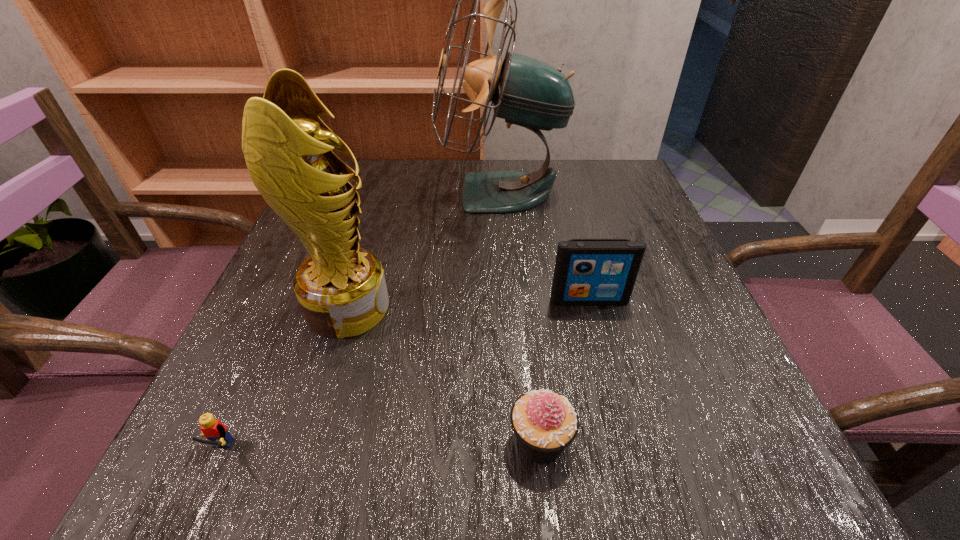
Identify the location of vacant area at the near edge of the desktop. This screenshot has width=960, height=540. (353, 470).

You are a GUI agent. You are given a task and a screenshot of the screen. Output one action in this format:
    pyautogui.click(x=<x>, y=<y>)
    Task: Click on the free space at the left edge of the desktop
    The image size is (960, 540).
    Given the screenshot: What is the action you would take?
    pyautogui.click(x=295, y=395)

Locate an element on the screen. free location at the right edge of the desktop is located at coordinates (681, 282).

I want to click on free space at the far left corner of the desktop, so click(x=393, y=160).

Image resolution: width=960 pixels, height=540 pixels. In the image, there is a desktop. What are the coordinates of `vacant region at the near right corner` in the screenshot? It's located at click(x=685, y=446).

This screenshot has height=540, width=960. I want to click on vacant area between the second object from left to right and the cupcake, so click(x=444, y=374).

Where is `vacant region between the fan and the award`? The image size is (960, 540). vacant region between the fan and the award is located at coordinates pos(424,251).

You are a GUI agent. You are given a task and a screenshot of the screen. Output one action in this format:
    pyautogui.click(x=<x>, y=<y>)
    Task: Click on the blank region between the award and the farthest object
    
    Given the screenshot: What is the action you would take?
    click(x=424, y=251)

Find the location of a particular element. Image resolution: width=960 pixels, height=540 pixels. free point between the iPod and the Lego is located at coordinates (404, 378).

The height and width of the screenshot is (540, 960). I want to click on free space between the third tallest object and the award, so click(468, 304).